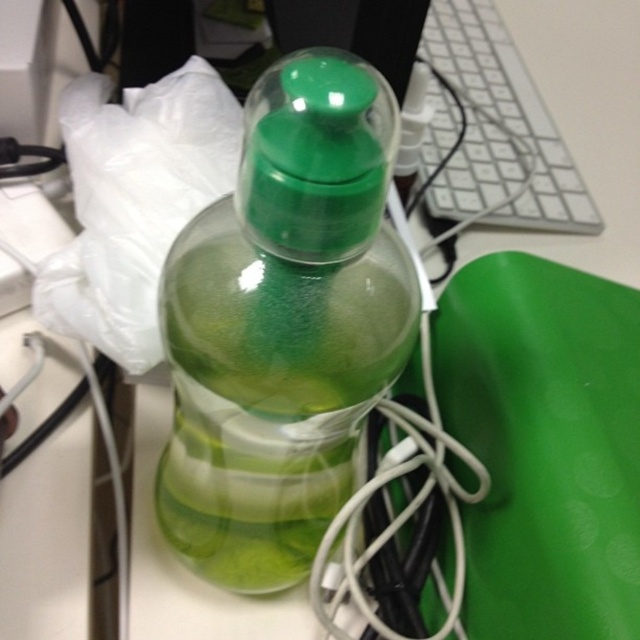
You need to place a new object on the desk between the transparent plastic bottle at center and the white plastic keyboard at upper right. Which object should you place closer to the thinner item to ensure stability?

The transparent plastic bottle at center is thinner than the white plastic keyboard at upper right, so you should place the new object closer to the transparent plastic bottle at center to ensure stability.

You are organizing cables on a desk and need to untangle them. You see two points marked on the desk. The first point is at coordinate point (323, 209) and the second is at point (477, 24). Which point is closer to you when looking at the desk from the front?

Point (323, 209) is in front of point (477, 24), so it is closer to you when looking at the desk from the front.